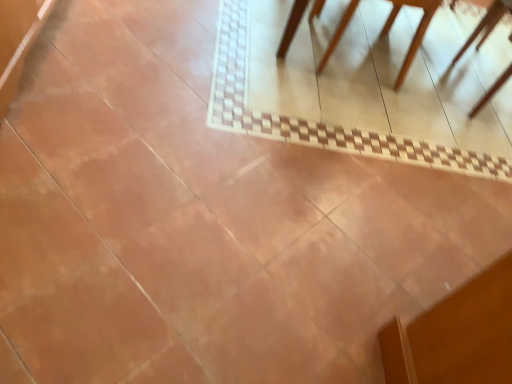
Identify the location of brown wooden chair at upper right. The width and height of the screenshot is (512, 384). click(486, 24).

What is the approximate width of brown wooden chair at upper right?

57.59 centimeters.

Describe the element at coordinates (486, 24) in the screenshot. I see `brown wooden chair at upper right` at that location.

Describe the element at coordinates (414, 34) in the screenshot. I see `light brown wooden table at upper right` at that location.

What is the approximate width of light brown wooden table at upper right?

The width of light brown wooden table at upper right is 33.01 inches.

Image resolution: width=512 pixels, height=384 pixels. I want to click on light brown wooden table at upper right, so click(414, 34).

You are a GUI agent. You are given a task and a screenshot of the screen. Output one action in this format:
    pyautogui.click(x=<x>, y=<y>)
    Task: Click on the brown wooden chair at upper right
    
    Given the screenshot: What is the action you would take?
    [486, 24]

In the image, is brown wooden chair at upper right on the left side or the right side of light brown wooden table at upper right?

Based on their positions, brown wooden chair at upper right is located to the right of light brown wooden table at upper right.

Who is more distant, brown wooden chair at upper right or light brown wooden table at upper right?

brown wooden chair at upper right is behind.

Considering the points (487, 92) and (505, 7), which point is behind, point (487, 92) or point (505, 7)?

The point (505, 7) is farther from the camera.

From the image's perspective, between brown wooden chair at upper right and light brown wooden table at upper right, which one is located above?

From the image's view, light brown wooden table at upper right is above.

From a real-world perspective, is brown wooden chair at upper right physically located above or below light brown wooden table at upper right?

From a real-world perspective, brown wooden chair at upper right is physically below light brown wooden table at upper right.

Which of these two, brown wooden chair at upper right or light brown wooden table at upper right, is thinner?

brown wooden chair at upper right.

Considering the relative sizes of brown wooden chair at upper right and light brown wooden table at upper right in the image provided, is brown wooden chair at upper right shorter than light brown wooden table at upper right?

Correct, brown wooden chair at upper right is not as tall as light brown wooden table at upper right.

Does brown wooden chair at upper right have a smaller size compared to light brown wooden table at upper right?

Correct, brown wooden chair at upper right occupies less space than light brown wooden table at upper right.

Which is correct: brown wooden chair at upper right is inside light brown wooden table at upper right, or outside of it?

brown wooden chair at upper right lies within the bounds of light brown wooden table at upper right.

Are brown wooden chair at upper right and light brown wooden table at upper right beside each other?

They are not placed beside each other.

Is light brown wooden table at upper right at the back of brown wooden chair at upper right?

Yes, brown wooden chair at upper right is facing away from light brown wooden table at upper right.

Looking at this image, what's the angular difference between brown wooden chair at upper right and light brown wooden table at upper right's facing directions?

They differ by 178 degrees in their facing directions.

You are a GUI agent. You are given a task and a screenshot of the screen. Output one action in this format:
    pyautogui.click(x=<x>, y=<y>)
    Task: Click on the furniture that appears above the brown wooden chair at upper right (from a real-world perspective)
    
    Given the screenshot: What is the action you would take?
    pyautogui.click(x=414, y=34)

Between light brown wooden table at upper right and brown wooden chair at upper right, which one appears on the left side from the viewer's perspective?

light brown wooden table at upper right.

Does light brown wooden table at upper right lie behind brown wooden chair at upper right?

That is False.

Between point (484, 27) and point (490, 97), which one is positioned behind?

The point (484, 27) is more distant.

From the image's perspective, is light brown wooden table at upper right on brown wooden chair at upper right?

Yes, from the image's perspective, light brown wooden table at upper right is above brown wooden chair at upper right.

From a real-world perspective, which is physically above, light brown wooden table at upper right or brown wooden chair at upper right?

light brown wooden table at upper right.

Can you confirm if light brown wooden table at upper right is wider than brown wooden chair at upper right?

Yes, light brown wooden table at upper right is wider than brown wooden chair at upper right.

Looking at this image, can you confirm if light brown wooden table at upper right is taller than brown wooden chair at upper right?

Yes, light brown wooden table at upper right is taller than brown wooden chair at upper right.

Is light brown wooden table at upper right smaller than brown wooden chair at upper right?

Actually, light brown wooden table at upper right might be larger than brown wooden chair at upper right.

Is light brown wooden table at upper right inside the boundaries of brown wooden chair at upper right, or outside?

light brown wooden table at upper right is not enclosed by brown wooden chair at upper right.

In the scene shown: Is light brown wooden table at upper right in contact with brown wooden chair at upper right?

light brown wooden table at upper right and brown wooden chair at upper right are clearly separated.

From the picture: Does light brown wooden table at upper right turn towards brown wooden chair at upper right?

Yes, light brown wooden table at upper right is oriented towards brown wooden chair at upper right.

Looking at this image, how different are the orientations of light brown wooden table at upper right and brown wooden chair at upper right in degrees?

178 degrees separate the facing orientations of light brown wooden table at upper right and brown wooden chair at upper right.

Image resolution: width=512 pixels, height=384 pixels. In order to click on chair below the light brown wooden table at upper right (from a real-world perspective) in this screenshot , I will do `click(486, 24)`.

At what (x,y) coordinates should I click in order to perform the action: click on chair on the right of the light brown wooden table at upper right. Please return your answer as a coordinate pair (x, y). Looking at the image, I should click on (486, 24).

Where is `furniture in front of the brown wooden chair at upper right`? furniture in front of the brown wooden chair at upper right is located at coordinates (x=414, y=34).